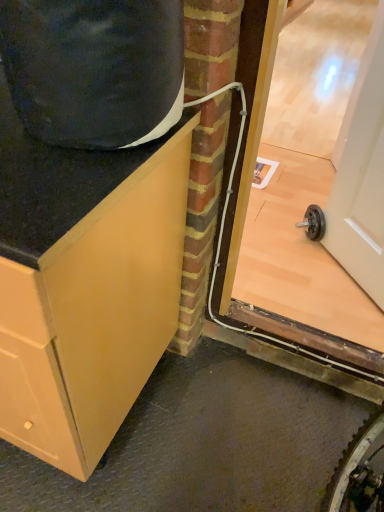
Question: Considering the relative sizes of transparent glass door at right and white glossy door at upper right in the image provided, is transparent glass door at right thinner than white glossy door at upper right?

Choices:
 (A) yes
 (B) no

Answer: (B)

Question: Can you confirm if transparent glass door at right is positioned to the right of white glossy door at upper right?

Choices:
 (A) no
 (B) yes

Answer: (A)

Question: Considering the relative sizes of transparent glass door at right and white glossy door at upper right in the image provided, is transparent glass door at right bigger than white glossy door at upper right?

Choices:
 (A) yes
 (B) no

Answer: (A)

Question: Is white glossy door at upper right at the back of transparent glass door at right?

Choices:
 (A) no
 (B) yes

Answer: (B)

Question: Considering the relative sizes of transparent glass door at right and white glossy door at upper right in the image provided, is transparent glass door at right shorter than white glossy door at upper right?

Choices:
 (A) yes
 (B) no

Answer: (B)

Question: Is matte wood cabinet at left in front of or behind transparent glass door at right in the image?

Choices:
 (A) front
 (B) behind

Answer: (A)

Question: Looking at the image, does matte wood cabinet at left seem bigger or smaller compared to transparent glass door at right?

Choices:
 (A) big
 (B) small

Answer: (A)

Question: Is point (46, 316) positioned closer to the camera than point (339, 278)?

Choices:
 (A) closer
 (B) farther

Answer: (A)

Question: Is matte wood cabinet at left situated inside transparent glass door at right or outside?

Choices:
 (A) outside
 (B) inside

Answer: (A)

Question: Considering their positions, is transparent glass door at right located in front of or behind white glossy door at upper right?

Choices:
 (A) front
 (B) behind

Answer: (A)

Question: Do you think transparent glass door at right is within white glossy door at upper right, or outside of it?

Choices:
 (A) outside
 (B) inside

Answer: (A)

Question: Is transparent glass door at right taller or shorter than white glossy door at upper right?

Choices:
 (A) tall
 (B) short

Answer: (A)

Question: Considering the positions of transparent glass door at right and white glossy door at upper right in the image, is transparent glass door at right bigger or smaller than white glossy door at upper right?

Choices:
 (A) small
 (B) big

Answer: (B)

Question: Considering their positions, is white glossy door at upper right located in front of or behind transparent glass door at right?

Choices:
 (A) behind
 (B) front

Answer: (A)

Question: Which is correct: white glossy door at upper right is inside transparent glass door at right, or outside of it?

Choices:
 (A) outside
 (B) inside

Answer: (A)